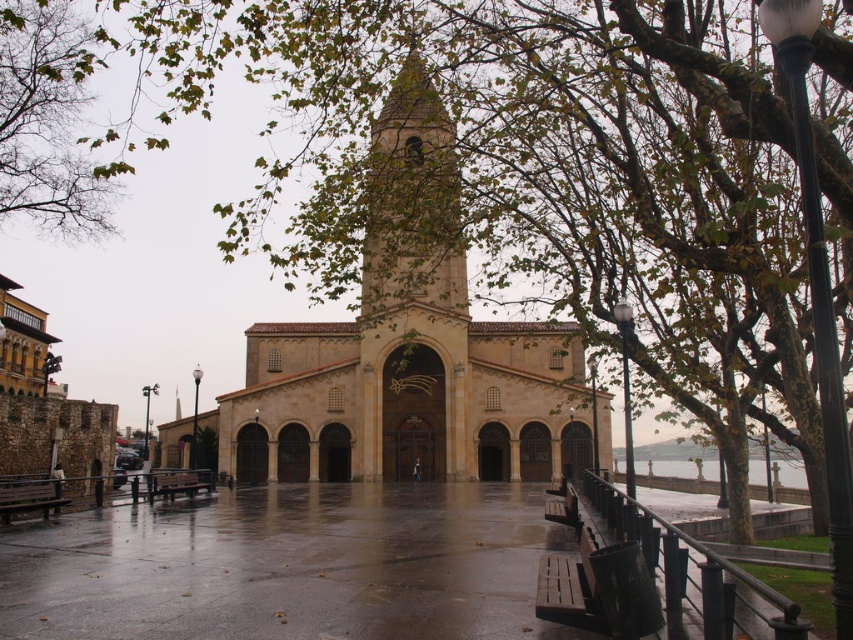
You are standing in a town square and see the beige stone church at center. If you want to reach the church quickly, how many steps would you need to take? Assume each step covers 0.75 meters.

The beige stone church at center is 96.90 meters away from viewer. Since each step covers 0.75 meters, you would need to take approximately 129 steps to reach the church.

You are standing in front of the historic church and want to reach the point marked at coordinates point [540,378]. If your maximum comfortable walking distance is 100 meters, can you comfortably walk to that point without feeling strained?

The point [540,378] is 115.34 meters away from you, which exceeds your comfortable walking distance of 100 meters. Therefore, walking to that point may feel strained.

You are planning to host a small gathering in the square in front of the historic church. You need to seat 10 people. Which bench, the wooden park bench at lower right or the wooden bench at lower left, can accommodate more guests?

The wooden park bench at lower right can accommodate more guests since it has a larger size compared to the wooden bench at lower left.